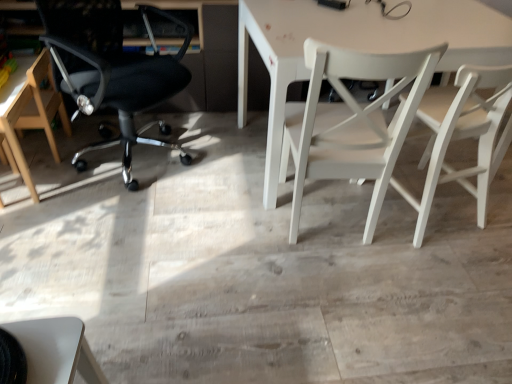
This screenshot has height=384, width=512. What are the coordinates of `free location in front of white matte chair at center, the 2th chair from the right` in the screenshot? It's located at (334, 294).